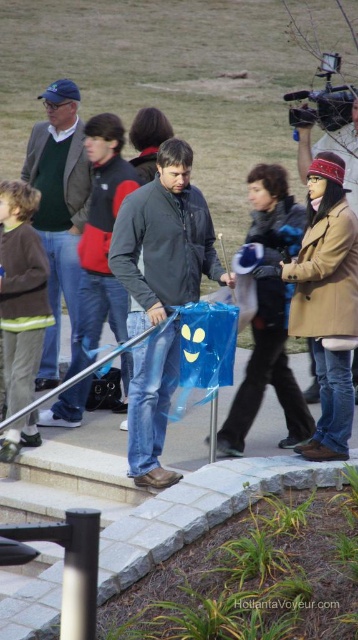
You are a GUI agent. You are given a task and a screenshot of the screen. Output one action in this format:
    pyautogui.click(x=<x>, y=<y>)
    Task: Click on the matte blue plastic bag at center
    This screenshot has width=358, height=640.
    Given the screenshot: What is the action you would take?
    tap(163, 241)

Does matte blue plastic bag at center come behind matte green sweater at upper left?

No, matte blue plastic bag at center is closer to the viewer.

Is point (160, 296) in front of point (76, 115)?

Yes, it is in front of point (76, 115).

I want to click on matte blue plastic bag at center, so click(x=163, y=241).

Between brown leather jacket at right and black plastic video camera at upper right, which one appears on the left side from the viewer's perspective?

Positioned to the left is brown leather jacket at right.

Find the location of `brown leather jacket at right`. brown leather jacket at right is located at coordinates (329, 147).